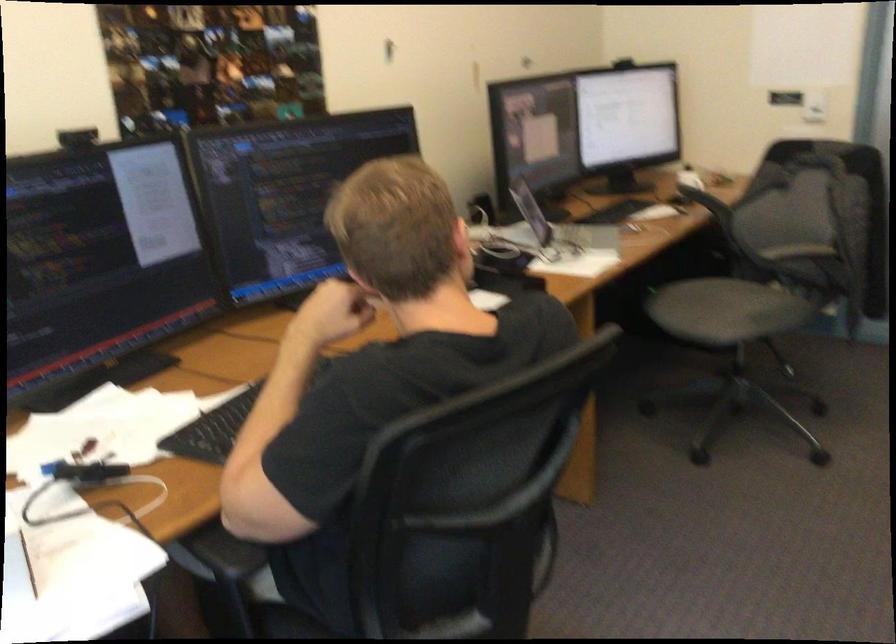
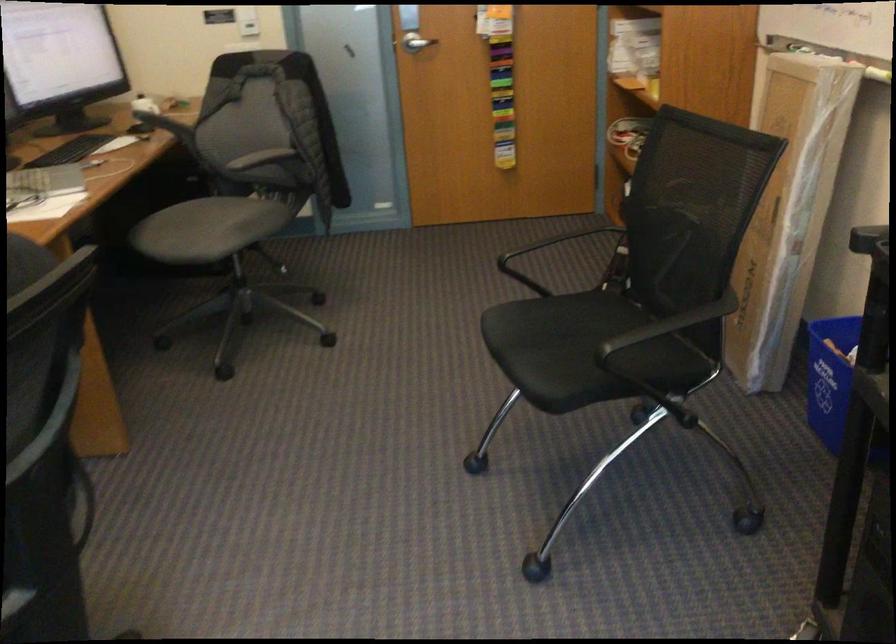
In the second image, find the point that corresponds to [718,304] in the first image.

(207, 229)